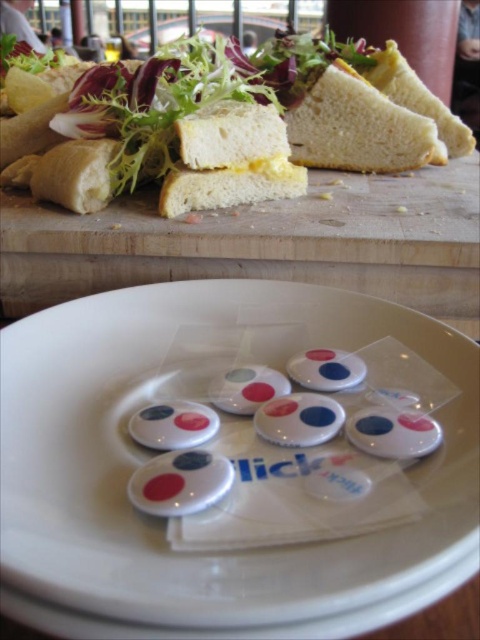
Question: Which point is closer to the camera taking this photo?

Choices:
 (A) (204, 394)
 (B) (369, 163)

Answer: (A)

Question: Is white plastic buttons at center positioned in front of white bread at upper right?

Choices:
 (A) yes
 (B) no

Answer: (A)

Question: Among these points, which one is farthest from the camera?

Choices:
 (A) click(439, 112)
 (B) click(308, 163)
 (C) click(405, 560)
 (D) click(267, 134)

Answer: (A)

Question: Which point appears closest to the camera in this image?

Choices:
 (A) (x=218, y=112)
 (B) (x=302, y=134)
 (C) (x=97, y=630)
 (D) (x=371, y=72)

Answer: (C)

Question: Is white plastic buttons at center positioned in front of white soft bread at center?

Choices:
 (A) yes
 (B) no

Answer: (A)

Question: Is white soft bread at center above white bread at upper right?

Choices:
 (A) yes
 (B) no

Answer: (B)